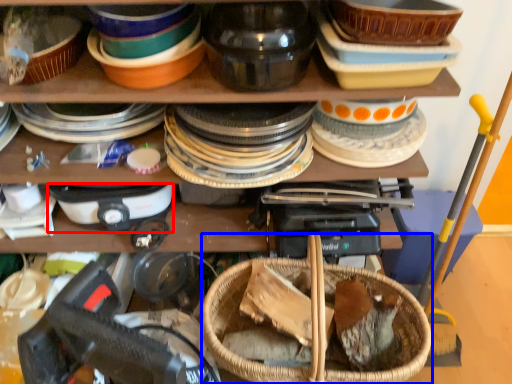
Question: Among these objects, which one is farthest to the camera, appliance (highlighted by a red box) or basket (highlighted by a blue box)?

Choices:
 (A) appliance
 (B) basket

Answer: (A)